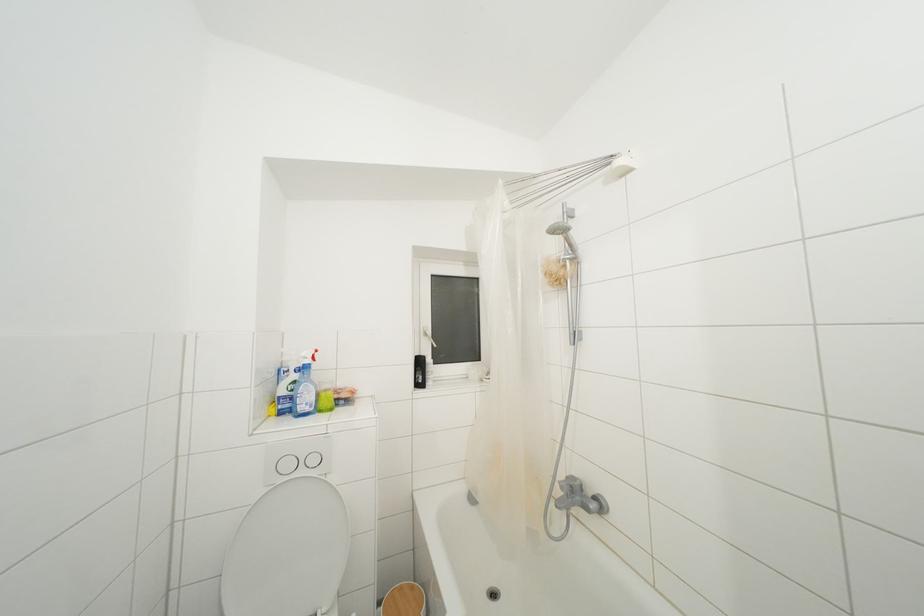
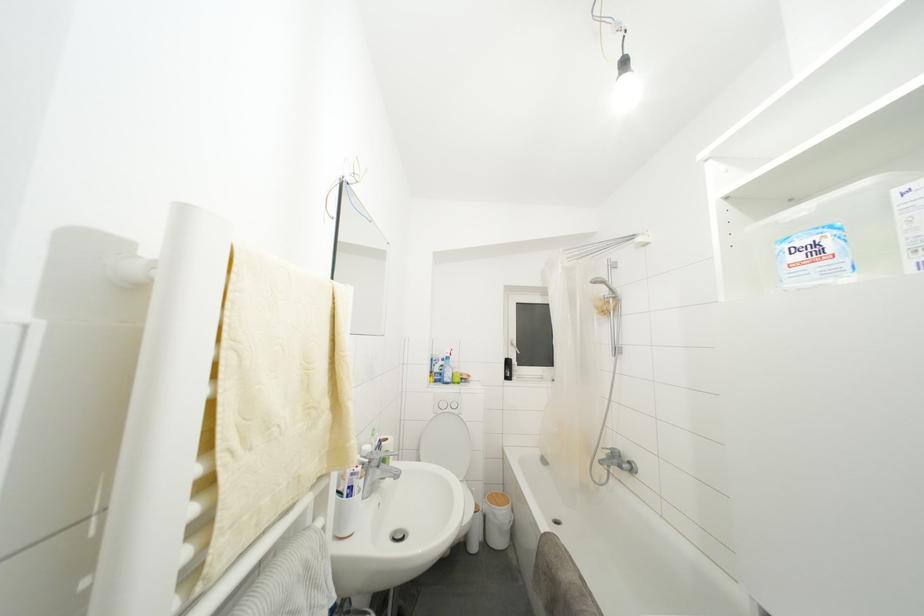
Question: The camera is either moving clockwise (left) or counter-clockwise (right) around the object. The first image is from the beginning of the video and the second image is from the end. Is the camera moving left or right when shooting the video?

Choices:
 (A) Left
 (B) Right

Answer: (B)